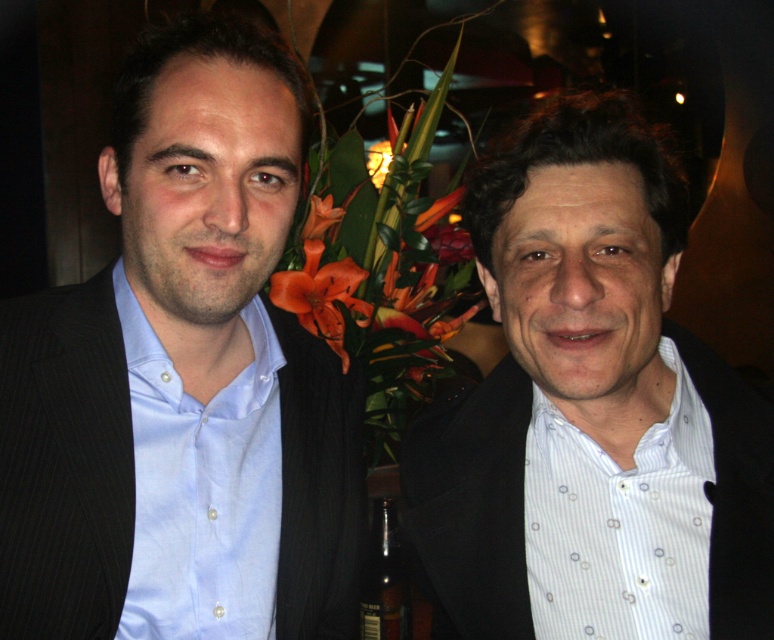
Does point (122, 160) lie in front of point (620, 221)?

No, (122, 160) is behind (620, 221).

Between point (180, 170) and point (725, 412), which one is positioned in front?

Point (180, 170) is in front.

Where is `matte black suit at left`? The width and height of the screenshot is (774, 640). matte black suit at left is located at coordinates (182, 380).